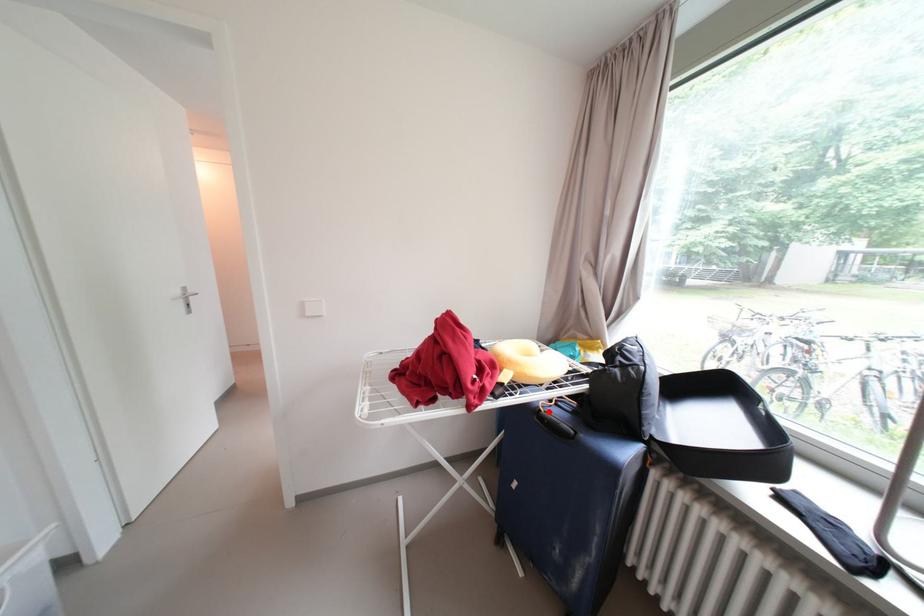
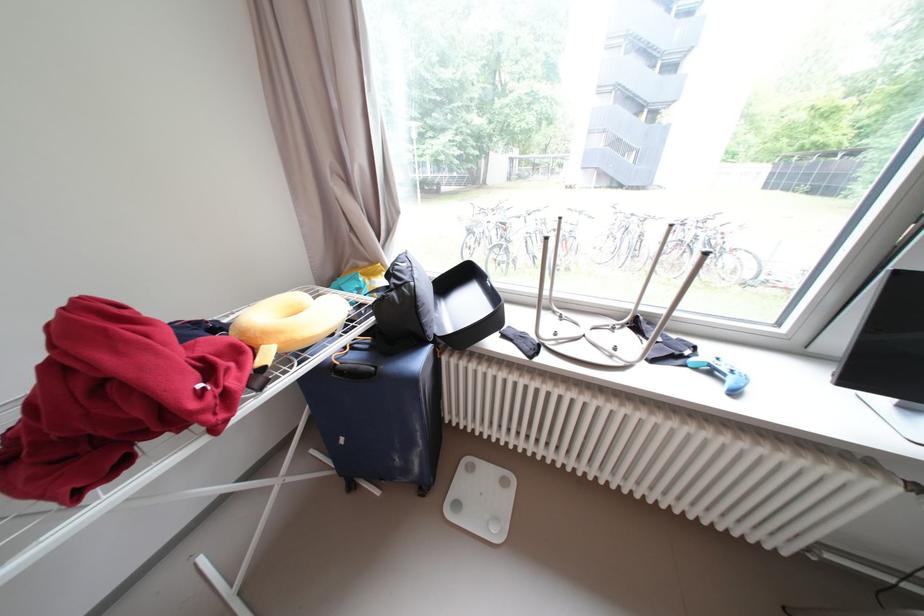
Question: A red point is marked in image1. In image2, is the corresponding 3D point closer to the camera or farther? Reply with the corresponding letter.

Choices:
 (A) The corresponding 3D point is closer.
 (B) The corresponding 3D point is farther.

Answer: (A)